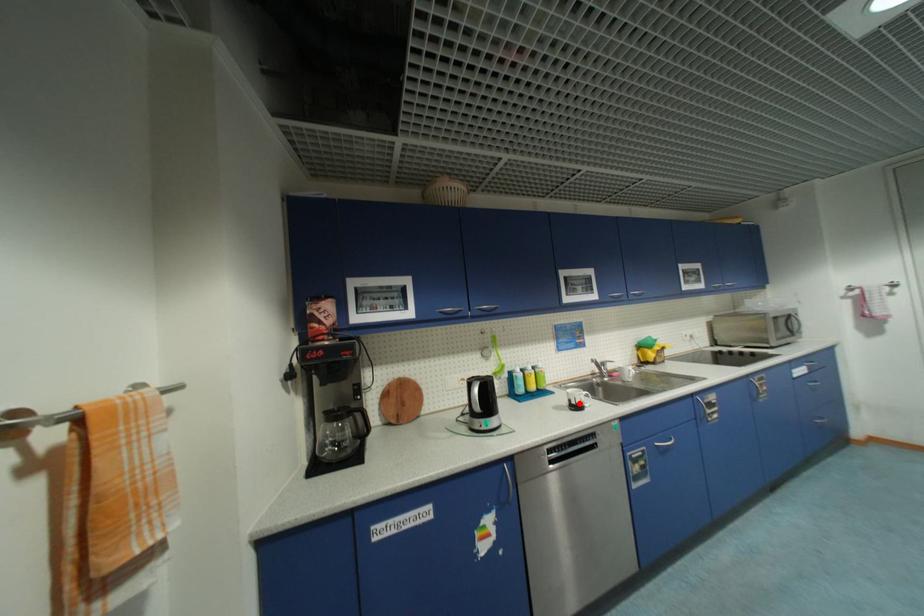
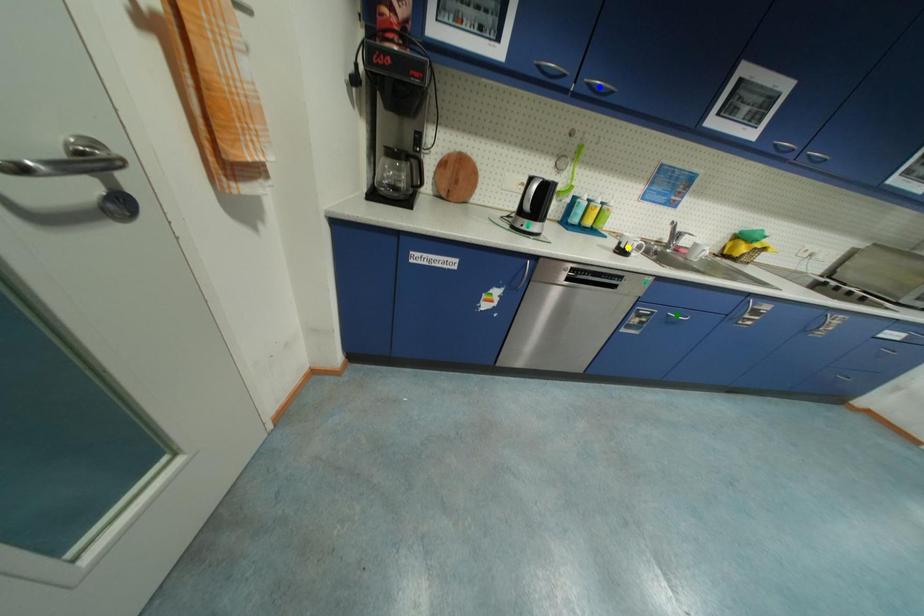
Question: I am providing you with two images of the same scene from different viewpoints. A red point is marked on the first image. You are given multiple points on the second image. Which spot in image 2 lines up with the point in image 1?

Choices:
 (A) yellow point
 (B) blue point
 (C) green point

Answer: (A)